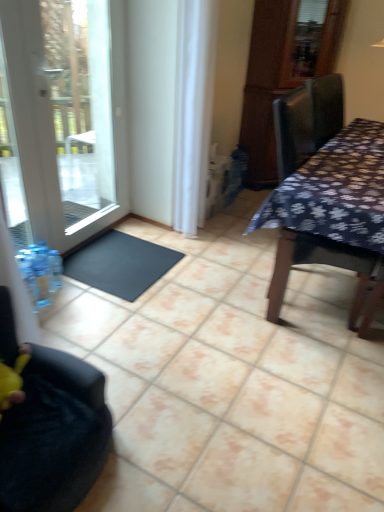
Identify the location of free space to the left of white sheer curtain at center. (159, 231).